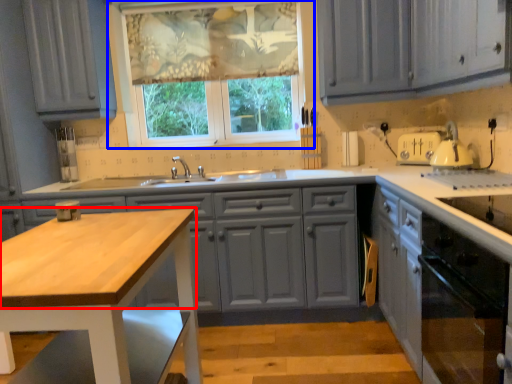
Question: Which point is further to the camera, countertop (highlighted by a red box) or window (highlighted by a blue box)?

Choices:
 (A) countertop
 (B) window

Answer: (B)